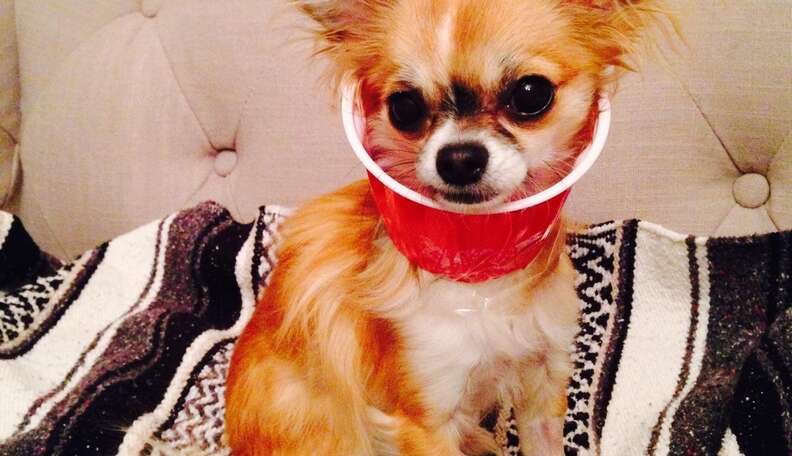
You are a GUI agent. You are given a task and a screenshot of the screen. Output one action in this format:
    pyautogui.click(x=<x>, y=<y>)
    Task: Click on the couch
    The image size is (792, 456).
    Given the screenshot: What is the action you would take?
    pyautogui.click(x=231, y=83)